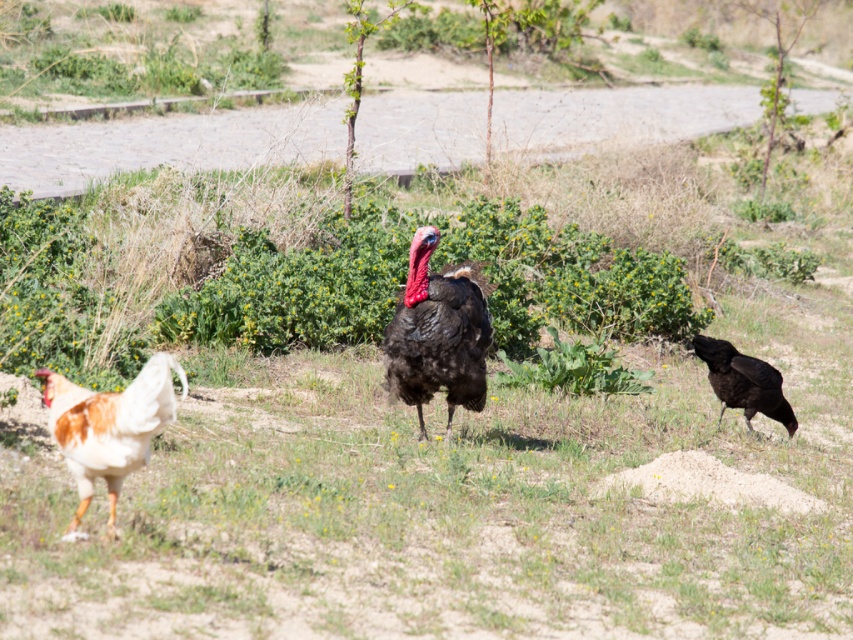
You are a photographer trying to capture the turkey in the center of the image. You notice a point at coordinates [438,333]. Can you determine if this point is on the turkey?

The point at coordinates [438,333] corresponds to the shiny dark feathers turkey at center, so yes, the point is on the turkey.

You are a farmer observing the birds in your yard. You notice the shiny dark feathers turkey at center and the shiny black turkey at right. Which turkey is taller?

The shiny dark feathers turkey at center is much taller than the shiny black turkey at right.

You are a farmer observing the birds in your yard. You notice the brown feathered chicken at left and the shiny black turkey at right. Which bird is located higher in the image?

The brown feathered chicken at left is positioned over shiny black turkey at right, so the brown feathered chicken at left is higher in the image.